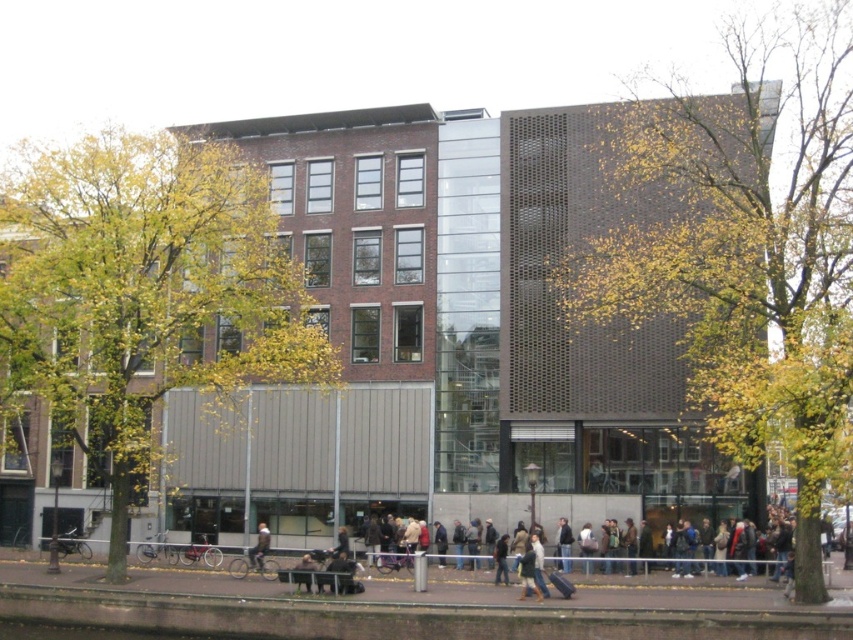
Is green leafy tree at center to the right of dark blue jeans at center from the viewer's perspective?

In fact, green leafy tree at center is to the left of dark blue jeans at center.

Is green leafy tree at center smaller than dark blue jeans at center?

No, green leafy tree at center is not smaller than dark blue jeans at center.

Is point (251, 380) closer to viewer compared to point (258, 540)?

No, (251, 380) is behind (258, 540).

I want to click on green leafy tree at center, so [142, 296].

Between green leafy tree at center and dark blue jacket at center, which one appears on the left side from the viewer's perspective?

Positioned to the left is green leafy tree at center.

Is point (279, 304) positioned after point (567, 528)?

Yes, point (279, 304) is behind point (567, 528).

Locate an element on the screen. Image resolution: width=853 pixels, height=640 pixels. green leafy tree at center is located at coordinates (142, 296).

Is point (566, 529) positioned before point (251, 552)?

Yes.

The image size is (853, 640). What do you see at coordinates (564, 545) in the screenshot?
I see `dark blue jacket at center` at bounding box center [564, 545].

Find the location of a particular element. Image resolution: width=853 pixels, height=640 pixels. dark blue jacket at center is located at coordinates (564, 545).